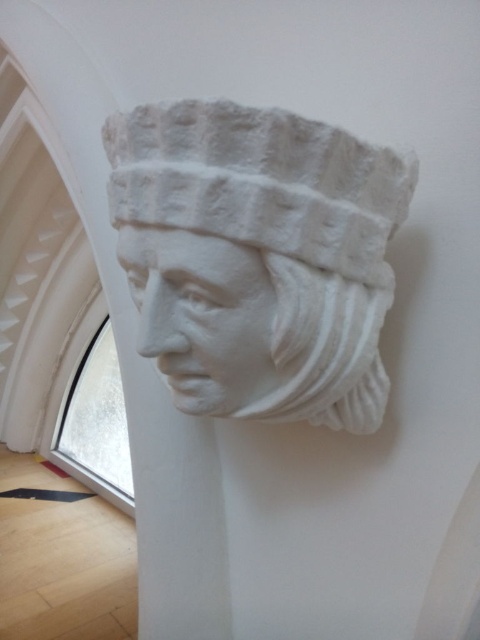
Question: Which point is farther from the camera taking this photo?

Choices:
 (A) (227, 301)
 (B) (307, 284)

Answer: (A)

Question: Can you confirm if white stone bust at upper center is thinner than white stone sculpture at center?

Choices:
 (A) no
 (B) yes

Answer: (A)

Question: Does white stone bust at upper center lie behind white stone sculpture at center?

Choices:
 (A) no
 (B) yes

Answer: (A)

Question: Is white stone bust at upper center positioned in front of white stone sculpture at center?

Choices:
 (A) no
 (B) yes

Answer: (B)